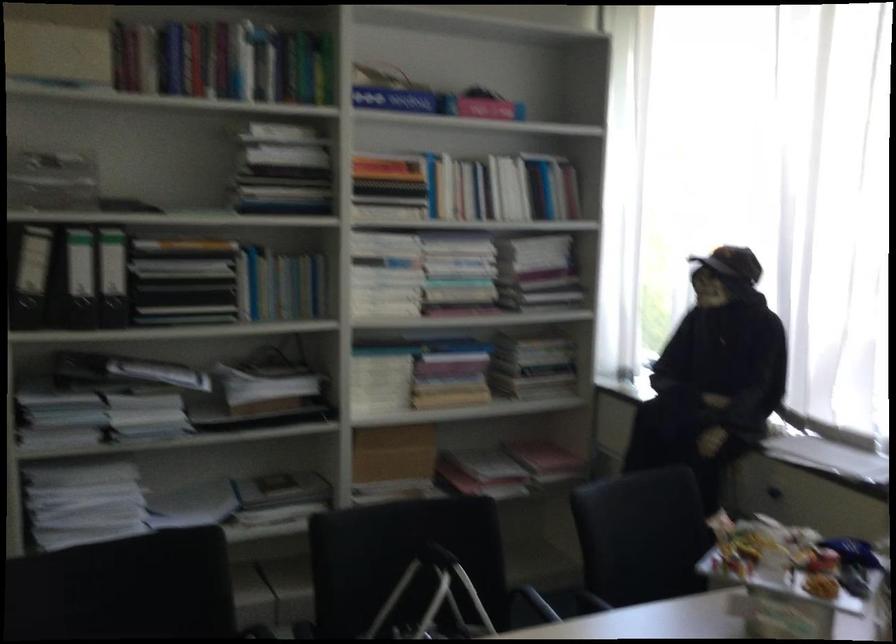
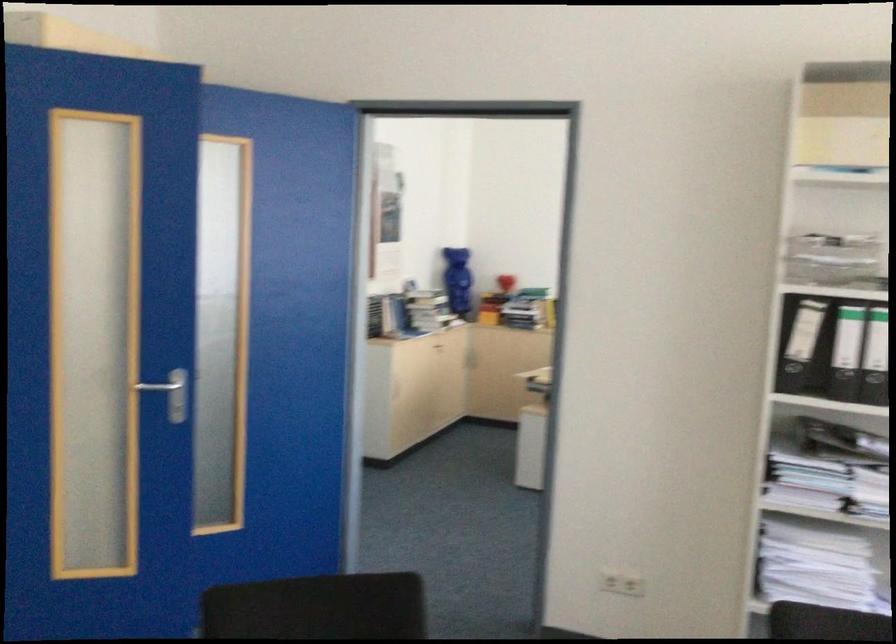
Find the pixel in the second image that matches pixel 99 281 in the first image.

(858, 355)